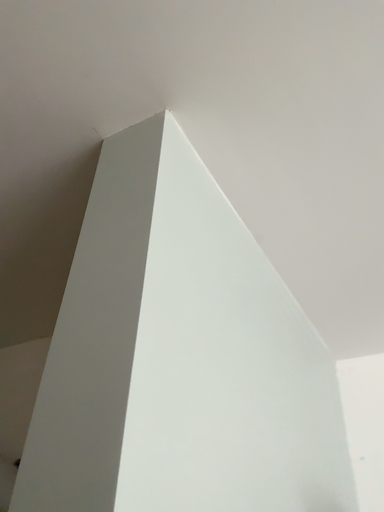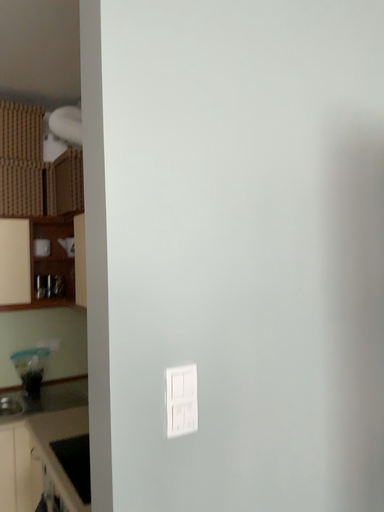
Question: How did the camera likely rotate when shooting the video?

Choices:
 (A) rotated downward
 (B) rotated upward

Answer: (A)